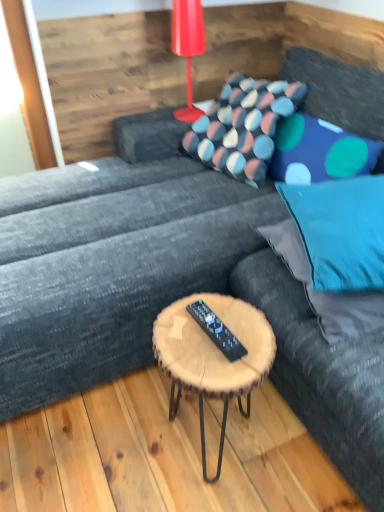
Question: From a real-world perspective, is blue fabric pillow at right, the first pillow from the front, on top of woodenmaterial/texturecoffee table at center?

Choices:
 (A) no
 (B) yes

Answer: (B)

Question: From the image's perspective, is blue fabric pillow at right, the 4th pillow in the back-to-front sequence, located beneath woodenmaterial/texturecoffee table at center?

Choices:
 (A) yes
 (B) no

Answer: (B)

Question: Is blue fabric pillow at right, the 4th pillow in the back-to-front sequence, not near woodenmaterial/texturecoffee table at center?

Choices:
 (A) yes
 (B) no

Answer: (B)

Question: Is blue fabric pillow at right, the 4th pillow in the back-to-front sequence, at the left side of woodenmaterial/texturecoffee table at center?

Choices:
 (A) yes
 (B) no

Answer: (B)

Question: Considering the relative sizes of blue fabric pillow at right, the first pillow from the front, and woodenmaterial/texturecoffee table at center in the image provided, is blue fabric pillow at right, the first pillow from the front, smaller than woodenmaterial/texturecoffee table at center?

Choices:
 (A) no
 (B) yes

Answer: (A)

Question: Would you say blue fabric pillow at upper right, acting as the 2th pillow starting from the back, is inside or outside woodenmaterial/texturecoffee table at center?

Choices:
 (A) outside
 (B) inside

Answer: (A)

Question: Is blue fabric pillow at upper right, the 3th pillow viewed from the front, taller or shorter than woodenmaterial/texturecoffee table at center?

Choices:
 (A) tall
 (B) short

Answer: (B)

Question: In terms of width, does blue fabric pillow at upper right, acting as the 2th pillow starting from the back, look wider or thinner when compared to woodenmaterial/texturecoffee table at center?

Choices:
 (A) thin
 (B) wide

Answer: (A)

Question: Does point (379, 151) appear closer or farther from the camera than point (228, 374)?

Choices:
 (A) farther
 (B) closer

Answer: (A)

Question: Is blue fabric pillow at right, the first pillow from the front, wider or thinner than teal fabric bean bag at center?

Choices:
 (A) wide
 (B) thin

Answer: (B)

Question: From a real-world perspective, is blue fabric pillow at right, the 4th pillow in the back-to-front sequence, positioned above or below teal fabric bean bag at center?

Choices:
 (A) below
 (B) above

Answer: (B)

Question: Considering the positions of blue fabric pillow at right, the 4th pillow in the back-to-front sequence, and teal fabric bean bag at center in the image, is blue fabric pillow at right, the 4th pillow in the back-to-front sequence, bigger or smaller than teal fabric bean bag at center?

Choices:
 (A) big
 (B) small

Answer: (B)

Question: Considering their positions, is blue fabric pillow at right, the first pillow from the front, located in front of or behind teal fabric bean bag at center?

Choices:
 (A) front
 (B) behind

Answer: (B)

Question: Is shiny red plastic table lamp at upper center wider or thinner than teal fabric bean bag at center?

Choices:
 (A) wide
 (B) thin

Answer: (B)

Question: Relative to teal fabric bean bag at center, is shiny red plastic table lamp at upper center in front or behind?

Choices:
 (A) front
 (B) behind

Answer: (B)